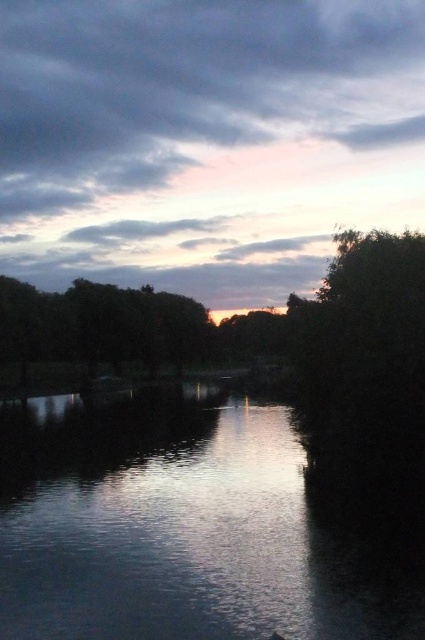
You are standing at the edge of the water and want to take a photo of the green leafy tree at center. Since the smooth water at center reflects the sky, will the tree be visible in the reflection?

The smooth water at center is in front of green leafy tree at center, so the tree is behind the water. Since reflections show what is above or behind the reflective surface, the tree would not be visible in the water reflection because it is located behind the water surface.

Based on the photo, you are standing on a small boat in the middle of the lake and notice the smooth water at center and the green leafy tree at center. Which object is closer to the horizon?

The smooth water at center is located below the green leafy tree at center, so the green leafy tree at center is closer to the horizon.

You are standing at the edge of the water and want to take a photo of the pastel sky at center. Where should you position yourself to capture the sky in the center of your viewfinder?

The pastel sky at center is located at point (x=206, y=140), so you should position yourself to aim your camera at those coordinates to capture it in the center of your viewfinder.